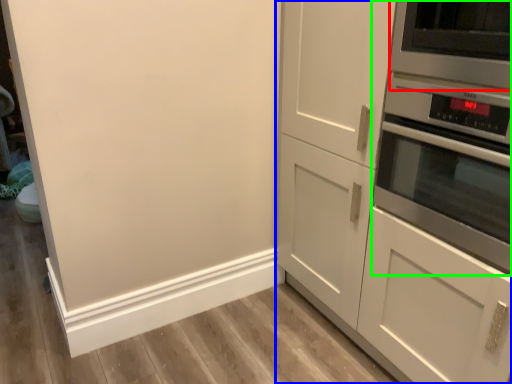
Question: Which object is positioned farthest from appliance (highlighted by a red box)? Select from cabinetry (highlighted by a blue box) and home appliance (highlighted by a green box).

Choices:
 (A) cabinetry
 (B) home appliance

Answer: (A)